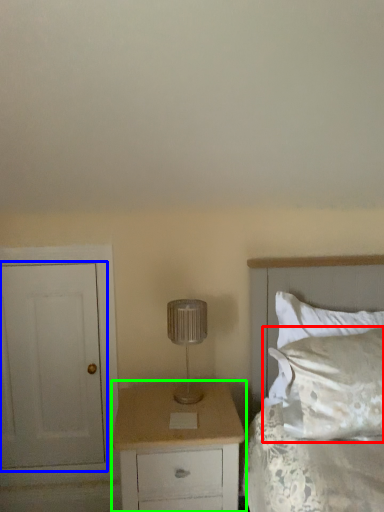
Question: Based on their relative distances, which object is farther from pillow (highlighted by a red box)? Choose from door (highlighted by a blue box) and chest of drawers (highlighted by a green box).

Choices:
 (A) door
 (B) chest of drawers

Answer: (A)